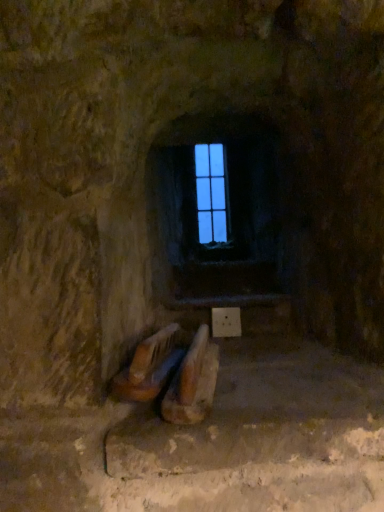
Question: Considering the relative sizes of wooden crate at lower center and clear glass window at center in the image provided, is wooden crate at lower center wider than clear glass window at center?

Choices:
 (A) no
 (B) yes

Answer: (B)

Question: From the image's perspective, is wooden crate at lower center beneath clear glass window at center?

Choices:
 (A) no
 (B) yes

Answer: (B)

Question: Is the depth of wooden crate at lower center less than that of clear glass window at center?

Choices:
 (A) yes
 (B) no

Answer: (A)

Question: From a real-world perspective, is wooden crate at lower center below clear glass window at center?

Choices:
 (A) yes
 (B) no

Answer: (A)

Question: Is wooden crate at lower center turned away from clear glass window at center?

Choices:
 (A) no
 (B) yes

Answer: (A)

Question: Is wooden crate at lower center positioned beyond the bounds of clear glass window at center?

Choices:
 (A) no
 (B) yes

Answer: (B)

Question: Is clear glass window at center facing away from wooden crate at lower center?

Choices:
 (A) yes
 (B) no

Answer: (B)

Question: Does clear glass window at center have a smaller size compared to wooden crate at lower center?

Choices:
 (A) yes
 (B) no

Answer: (A)

Question: Is clear glass window at center in contact with wooden crate at lower center?

Choices:
 (A) no
 (B) yes

Answer: (A)

Question: Is clear glass window at center facing towards wooden crate at lower center?

Choices:
 (A) yes
 (B) no

Answer: (A)

Question: From the image's perspective, does clear glass window at center appear higher than wooden crate at lower center?

Choices:
 (A) yes
 (B) no

Answer: (A)

Question: Does clear glass window at center have a greater height compared to wooden crate at lower center?

Choices:
 (A) no
 (B) yes

Answer: (B)

Question: Considering the positions of clear glass window at center and wooden crate at lower center in the image, is clear glass window at center taller or shorter than wooden crate at lower center?

Choices:
 (A) tall
 (B) short

Answer: (A)